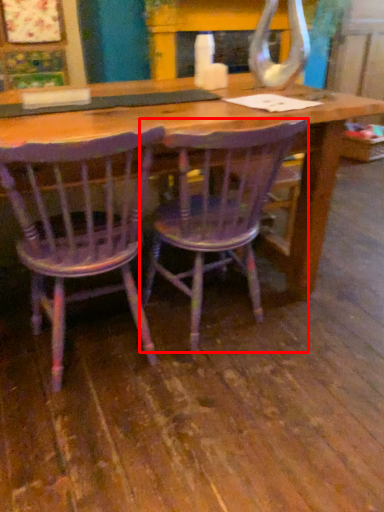
Question: From the image, what is the correct spatial relationship of chair (annotated by the red box) in relation to chair?

Choices:
 (A) left
 (B) right

Answer: (B)